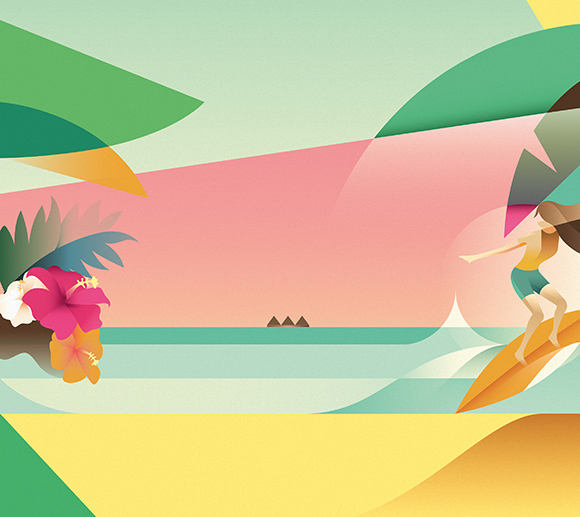
Where is `picture`? This screenshot has width=580, height=517. picture is located at coordinates (x=300, y=458).